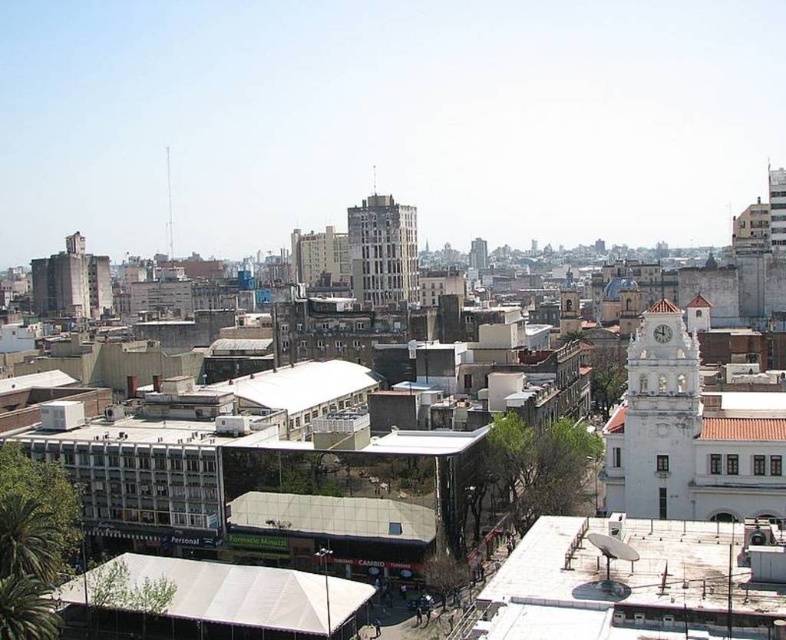
Which is above, gray concrete building at center or white marble clock at center-right?

Positioned higher is gray concrete building at center.

Can you confirm if gray concrete building at center is bigger than white marble clock at center-right?

Correct, gray concrete building at center is larger in size than white marble clock at center-right.

You are a GUI agent. You are given a task and a screenshot of the screen. Output one action in this format:
    pyautogui.click(x=<x>, y=<y>)
    Task: Click on the gray concrete building at center
    The image size is (786, 640).
    Given the screenshot: What is the action you would take?
    pyautogui.click(x=382, y=252)

This screenshot has width=786, height=640. Find the location of `gray concrete building at center`. gray concrete building at center is located at coordinates (382, 252).

Does white stone clock tower at center-right have a smaller size compared to gray concrete building at center?

Correct, white stone clock tower at center-right occupies less space than gray concrete building at center.

Does white stone clock tower at center-right have a greater width compared to gray concrete building at center?

In fact, white stone clock tower at center-right might be narrower than gray concrete building at center.

What are the coordinates of `white stone clock tower at center-right` in the screenshot? It's located at (660, 417).

Is white stone clock tower at center-right positioned at the back of white marble clock at center-right?

No, white stone clock tower at center-right is closer to the viewer.

Can you confirm if white stone clock tower at center-right is shorter than white marble clock at center-right?

No.

Is point (645, 362) positioned behind point (656, 330)?

That is False.

The width and height of the screenshot is (786, 640). Find the location of `white stone clock tower at center-right`. white stone clock tower at center-right is located at coordinates (660, 417).